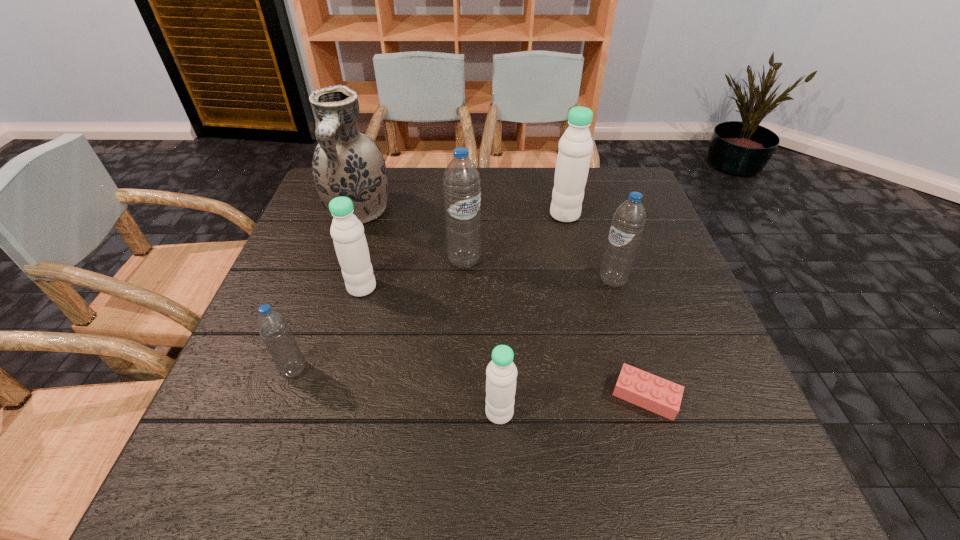
Locate an element on the screen. free space located 0.380m on the right of the second nearest water bottle is located at coordinates (501, 370).

What are the coordinates of `free spot located 0.320m on the right of the nearest white water bottle` in the screenshot? It's located at (690, 413).

Where is `vacant space situated 0.110m on the right of the pink Lego`? vacant space situated 0.110m on the right of the pink Lego is located at coordinates (737, 396).

Find the location of a particular element. The height and width of the screenshot is (540, 960). vase that is at the far edge is located at coordinates (346, 163).

The width and height of the screenshot is (960, 540). What are the coordinates of `water bottle that is at the far edge` in the screenshot? It's located at (575, 146).

At what (x,y) coordinates should I click in order to perform the action: click on vase at the left edge. Please return your answer as a coordinate pair (x, y). This screenshot has width=960, height=540. Looking at the image, I should click on (346, 163).

Identify the location of water bottle at the left edge. The height and width of the screenshot is (540, 960). (272, 325).

Find the location of `water bottle at the right edge`. water bottle at the right edge is located at coordinates (627, 226).

The width and height of the screenshot is (960, 540). Find the location of `Lego that is at the right edge`. Lego that is at the right edge is located at coordinates (658, 395).

Identify the location of object situated at the far left corner. (346, 163).